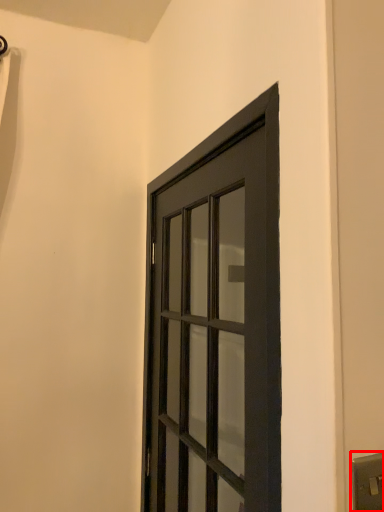
Question: In this image, where is light switch (annotated by the red box) located relative to door?

Choices:
 (A) left
 (B) right

Answer: (B)